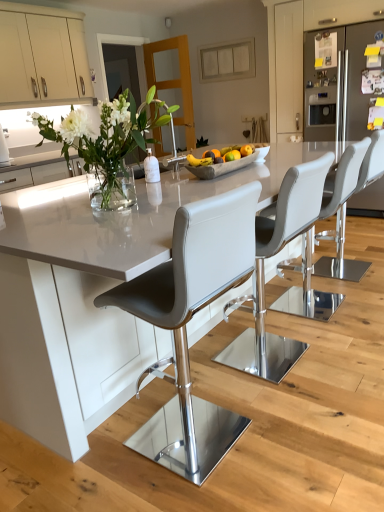
What do you see at coordinates (89, 285) in the screenshot? Image resolution: width=384 pixels, height=512 pixels. I see `white glossy table at center` at bounding box center [89, 285].

This screenshot has height=512, width=384. Describe the element at coordinates (199, 161) in the screenshot. I see `yellow matte banana at center` at that location.

Image resolution: width=384 pixels, height=512 pixels. What do you see at coordinates (263, 271) in the screenshot?
I see `white leather bar stool at center, which is the second chair in front-to-back order` at bounding box center [263, 271].

Measure the distance between point [290,176] and camera.

5.26 feet.

What do you see at coordinates (194, 313) in the screenshot? This screenshot has height=512, width=384. I see `matte gray bar stool at center, positioned as the fourth chair in back-to-front order` at bounding box center [194, 313].

Measure the distance between point (61, 132) and camera.

5.62 feet.

Where is `beige matte cabinet at upper left, which ranks as the first cabinetry in left-to-right order`? This screenshot has width=384, height=512. beige matte cabinet at upper left, which ranks as the first cabinetry in left-to-right order is located at coordinates (42, 55).

Image resolution: width=384 pixels, height=512 pixels. I want to click on gray leather stool at center, arranged as the 3th chair when viewed from the front, so click(344, 194).

Are gray leather stool at center, arranged as the 3th chair when viewed from the front, and yellow matte banana at center far apart?

gray leather stool at center, arranged as the 3th chair when viewed from the front, is positioned a significant distance from yellow matte banana at center.

Considering the relative positions of gray leather stool at center, the 2th chair from the back, and yellow matte banana at center in the image provided, is gray leather stool at center, the 2th chair from the back, to the right of yellow matte banana at center from the viewer's perspective?

Yes.

Does point (303, 241) appear closer or farther from the camera than point (206, 162)?

Point (303, 241) is positioned farther from the camera compared to point (206, 162).

Could you tell me if white glass vase at upper left is facing satin white cabinet at right, the 2th cabinetry in the left-to-right sequence?

No.

From a real-world perspective, is white glass vase at upper left on top of satin white cabinet at right, the 1th cabinetry viewed from the right?

Yes, from a real-world perspective, white glass vase at upper left is above satin white cabinet at right, the 1th cabinetry viewed from the right.

Which object is further away from the camera, white glass vase at upper left or satin white cabinet at right, the 1th cabinetry viewed from the right?

satin white cabinet at right, the 1th cabinetry viewed from the right, is behind.

Is satin white cabinet at right, the 2th cabinetry in the left-to-right sequence, located within white glass vase at upper left?

That's incorrect, satin white cabinet at right, the 2th cabinetry in the left-to-right sequence, is not inside white glass vase at upper left.

Considering the sizes of yellow matte banana at center and beige matte cabinet at upper left, which ranks as the first cabinetry in left-to-right order, in the image, is yellow matte banana at center wider or thinner than beige matte cabinet at upper left, which ranks as the first cabinetry in left-to-right order,?

Clearly, yellow matte banana at center has less width compared to beige matte cabinet at upper left, which ranks as the first cabinetry in left-to-right order.

Is yellow matte banana at center beside beige matte cabinet at upper left, arranged as the second cabinetry when viewed from the right?

No.

Is yellow matte banana at center turned away from beige matte cabinet at upper left, arranged as the second cabinetry when viewed from the right?

A: That's right, yellow matte banana at center is facing away from beige matte cabinet at upper left, arranged as the second cabinetry when viewed from the right.

Consider the image. Does yellow matte banana at center have a smaller size compared to beige matte cabinet at upper left, arranged as the second cabinetry when viewed from the right?

Indeed, yellow matte banana at center has a smaller size compared to beige matte cabinet at upper left, arranged as the second cabinetry when viewed from the right.

Is white glossy table at center closer to the viewer compared to matte gray bar stool at center, which ranks as the fourth chair in front-to-back order?

Yes.

From the picture: From a real-world perspective, is white glossy table at center located higher than matte gray bar stool at center, which is counted as the first chair, starting from the back?

Actually, white glossy table at center is physically below matte gray bar stool at center, which is counted as the first chair, starting from the back, in the real world.

Considering the sizes of white glossy table at center and matte gray bar stool at center, which ranks as the fourth chair in front-to-back order, in the image, is white glossy table at center taller or shorter than matte gray bar stool at center, which ranks as the fourth chair in front-to-back order,?

white glossy table at center is shorter than matte gray bar stool at center, which ranks as the fourth chair in front-to-back order.

Considering the sizes of yellow matte banana at center and gray leather stool at center, arranged as the 3th chair when viewed from the front, in the image, is yellow matte banana at center taller or shorter than gray leather stool at center, arranged as the 3th chair when viewed from the front,?

Clearly, yellow matte banana at center is shorter compared to gray leather stool at center, arranged as the 3th chair when viewed from the front.

From the image's perspective, relative to gray leather stool at center, arranged as the 3th chair when viewed from the front, is yellow matte banana at center above or below?

Based on their image positions, yellow matte banana at center is located above gray leather stool at center, arranged as the 3th chair when viewed from the front.

Which object is wider, yellow matte banana at center or gray leather stool at center, the 2th chair from the back?

Wider between the two is gray leather stool at center, the 2th chair from the back.

Who is taller, yellow matte banana at center or white glossy table at center?

white glossy table at center is taller.

Considering the sizes of objects yellow matte banana at center and white glossy table at center in the image provided, who is thinner, yellow matte banana at center or white glossy table at center?

yellow matte banana at center is thinner.

Which object is closer to the camera, yellow matte banana at center or white glossy table at center?

white glossy table at center.

What's the angular difference between yellow matte banana at center and white glossy table at center's facing directions?

The angular difference between yellow matte banana at center and white glossy table at center is 0.67 degrees.

Does white leather bar stool at center, which is the second chair in front-to-back order, appear on the right side of white glossy table at center?

Indeed, white leather bar stool at center, which is the second chair in front-to-back order, is positioned on the right side of white glossy table at center.

Considering the relative positions of white leather bar stool at center, which is the second chair in front-to-back order, and white glossy table at center in the image provided, is white leather bar stool at center, which is the second chair in front-to-back order, behind white glossy table at center?

That is True.

Could white glossy table at center be considered to be inside white leather bar stool at center, which ranks as the 3th chair in back-to-front order?

No, white glossy table at center is located outside of white leather bar stool at center, which ranks as the 3th chair in back-to-front order.

From a real-world perspective, is white leather bar stool at center, which ranks as the 3th chair in back-to-front order, located beneath white glossy table at center?

No, from a real-world perspective, white leather bar stool at center, which ranks as the 3th chair in back-to-front order, is not below white glossy table at center.

Where is `banana in front of the gray leather stool at center, arranged as the 3th chair when viewed from the front`? Image resolution: width=384 pixels, height=512 pixels. banana in front of the gray leather stool at center, arranged as the 3th chair when viewed from the front is located at coordinates (199, 161).

Locate an element on the screen. The image size is (384, 512). floral arrangement above the satin white cabinet at right, the 1th cabinetry viewed from the right (from a real-world perspective) is located at coordinates (107, 138).

When comparing their distances from gray leather stool at center, the 2th chair from the back, does white leather bar stool at center, which is the second chair in front-to-back order, or white glossy table at center seem closer?

A: Among the two, white leather bar stool at center, which is the second chair in front-to-back order, is located nearer to gray leather stool at center, the 2th chair from the back.

Estimate the real-world distances between objects in this image. Which object is further from white leather bar stool at center, which is the second chair in front-to-back order, white glossy table at center or matte gray bar stool at center, which is counted as the first chair, starting from the back?

white glossy table at center is further to white leather bar stool at center, which is the second chair in front-to-back order.

When comparing their distances from beige matte cabinet at upper left, arranged as the second cabinetry when viewed from the right, does matte gray bar stool at center, positioned as the fourth chair in back-to-front order, or satin white cabinet at right, the 2th cabinetry in the left-to-right sequence, seem further?

Based on the image, matte gray bar stool at center, positioned as the fourth chair in back-to-front order, appears to be further to beige matte cabinet at upper left, arranged as the second cabinetry when viewed from the right.

Estimate the real-world distances between objects in this image. Which object is closer to satin white cabinet at right, the 1th cabinetry viewed from the right, gray leather stool at center, arranged as the 3th chair when viewed from the front, or white glass vase at upper left?

gray leather stool at center, arranged as the 3th chair when viewed from the front, is positioned closer to the anchor satin white cabinet at right, the 1th cabinetry viewed from the right.

Which object lies nearer to the anchor point beige matte cabinet at upper left, which ranks as the first cabinetry in left-to-right order, gray leather stool at center, arranged as the 3th chair when viewed from the front, or white glass vase at upper left?

white glass vase at upper left lies closer to beige matte cabinet at upper left, which ranks as the first cabinetry in left-to-right order, than the other object.

Based on their spatial positions, is yellow matte banana at center or matte gray bar stool at center, positioned as the fourth chair in back-to-front order, further from satin white cabinet at right, the 2th cabinetry in the left-to-right sequence?

matte gray bar stool at center, positioned as the fourth chair in back-to-front order, lies further to satin white cabinet at right, the 2th cabinetry in the left-to-right sequence, than the other object.

From the image, which object appears to be nearer to matte gray bar stool at center, positioned as the fourth chair in back-to-front order, beige matte cabinet at upper left, arranged as the second cabinetry when viewed from the right, or white glossy table at center?

The object closer to matte gray bar stool at center, positioned as the fourth chair in back-to-front order, is white glossy table at center.

When comparing their distances from satin white cabinet at right, the 1th cabinetry viewed from the right, does white leather bar stool at center, which is the second chair in front-to-back order, or matte gray bar stool at center, acting as the first chair starting from the front, seem further?

Based on the image, matte gray bar stool at center, acting as the first chair starting from the front, appears to be further to satin white cabinet at right, the 1th cabinetry viewed from the right.

The height and width of the screenshot is (512, 384). I want to click on banana between white glass vase at upper left and matte gray bar stool at center, which is counted as the first chair, starting from the back, from left to right, so click(199, 161).

At what (x,y) coordinates should I click in order to perform the action: click on banana positioned between white leather bar stool at center, which ranks as the 3th chair in back-to-front order, and satin white cabinet at right, the 1th cabinetry viewed from the right, from near to far. Please return your answer as a coordinate pair (x, y). Looking at the image, I should click on pyautogui.click(x=199, y=161).

What are the coordinates of `chair between white leather bar stool at center, which ranks as the 3th chair in back-to-front order, and matte gray bar stool at center, which is counted as the first chair, starting from the back, from front to back` in the screenshot? It's located at (344, 194).

The image size is (384, 512). I want to click on floral arrangement positioned between white glossy table at center and matte gray bar stool at center, which is counted as the first chair, starting from the back, from near to far, so click(107, 138).